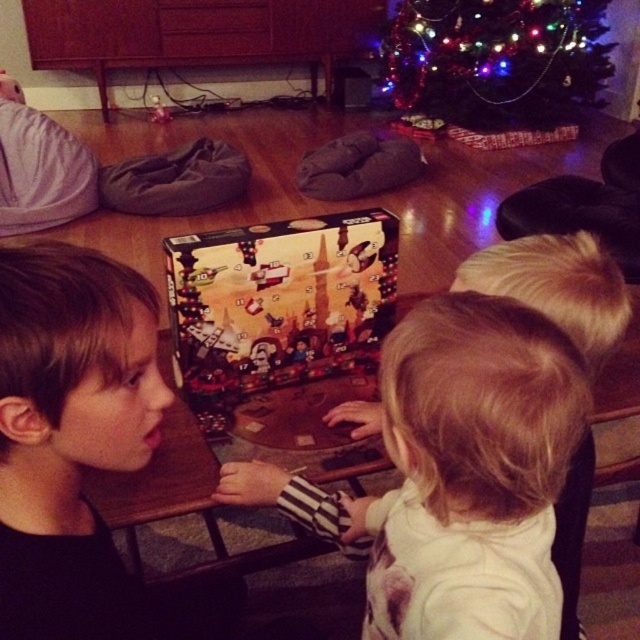
Question: Is printed cardboard advent calendar at center bigger than decorated plastic christmas tree at upper center?

Choices:
 (A) yes
 (B) no

Answer: (B)

Question: Which point appears farthest from the camera in this image?

Choices:
 (A) (556, 6)
 (B) (221, 403)

Answer: (A)

Question: In this image, where is brown matte hair at center located relative to decorated plastic christmas tree at upper center?

Choices:
 (A) above
 (B) below

Answer: (B)

Question: Estimate the real-world distances between objects in this image. Which object is farther from the decorated plastic christmas tree at upper center?

Choices:
 (A) brown matte hair at center
 (B) white soft shirt at center

Answer: (A)

Question: Among these points, which one is nearest to the camera?

Choices:
 (A) (68, 536)
 (B) (385, 80)

Answer: (A)

Question: Can you confirm if printed cardboard advent calendar at center is smaller than decorated plastic christmas tree at upper center?

Choices:
 (A) no
 (B) yes

Answer: (B)